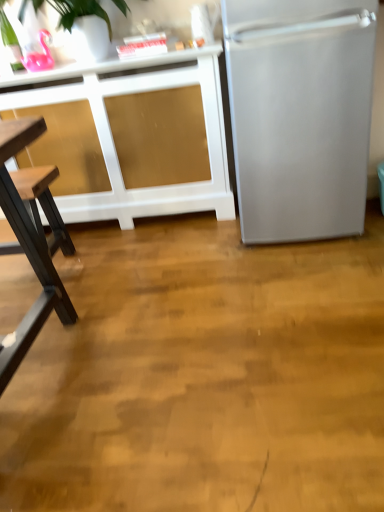
Question: Is satin silver refrigerator at right located outside white matte cabinet at upper left?

Choices:
 (A) yes
 (B) no

Answer: (A)

Question: Can you confirm if satin silver refrigerator at right is positioned to the left of white matte cabinet at upper left?

Choices:
 (A) no
 (B) yes

Answer: (A)

Question: Does satin silver refrigerator at right have a lesser width compared to white matte cabinet at upper left?

Choices:
 (A) no
 (B) yes

Answer: (A)

Question: Is satin silver refrigerator at right oriented away from white matte cabinet at upper left?

Choices:
 (A) no
 (B) yes

Answer: (A)

Question: Is satin silver refrigerator at right beside white matte cabinet at upper left?

Choices:
 (A) yes
 (B) no

Answer: (B)

Question: Is the depth of satin silver refrigerator at right greater than that of white matte cabinet at upper left?

Choices:
 (A) no
 (B) yes

Answer: (A)

Question: From the image's perspective, is white matte cabinet at upper left beneath satin silver refrigerator at right?

Choices:
 (A) no
 (B) yes

Answer: (B)

Question: Would you say white matte cabinet at upper left is a long distance from satin silver refrigerator at right?

Choices:
 (A) yes
 (B) no

Answer: (B)

Question: Is white matte cabinet at upper left wider than satin silver refrigerator at right?

Choices:
 (A) yes
 (B) no

Answer: (B)

Question: Is white matte cabinet at upper left in front of satin silver refrigerator at right?

Choices:
 (A) no
 (B) yes

Answer: (A)

Question: From a real-world perspective, is white matte cabinet at upper left under satin silver refrigerator at right?

Choices:
 (A) no
 (B) yes

Answer: (B)

Question: Would you say white matte cabinet at upper left is outside satin silver refrigerator at right?

Choices:
 (A) no
 (B) yes

Answer: (B)

Question: Based on their sizes in the image, would you say satin silver refrigerator at right is bigger or smaller than white matte cabinet at upper left?

Choices:
 (A) small
 (B) big

Answer: (B)